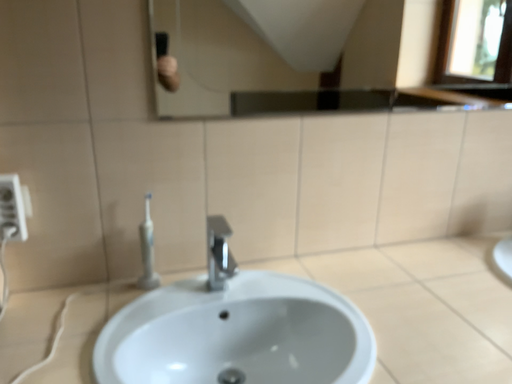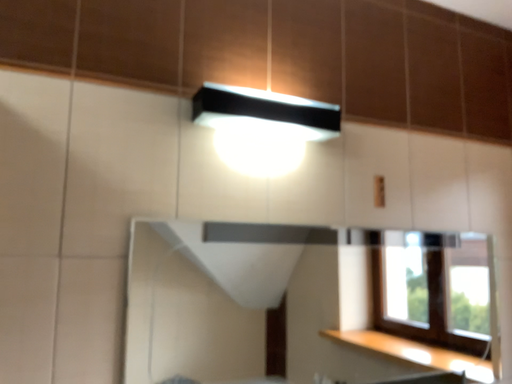
Question: How did the camera likely rotate when shooting the video?

Choices:
 (A) rotated left
 (B) rotated right

Answer: (B)